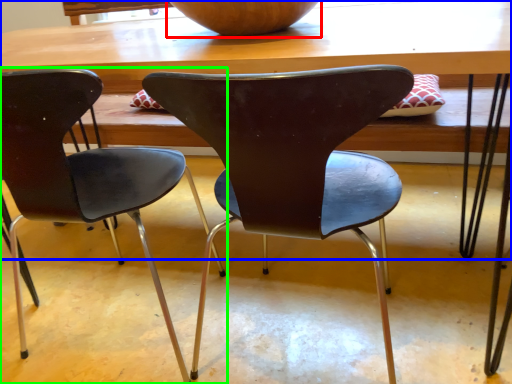
Question: Based on their relative distances, which object is nearer to bowl (highlighted by a red box)? Choose from table (highlighted by a blue box) and chair (highlighted by a green box).

Choices:
 (A) table
 (B) chair

Answer: (A)